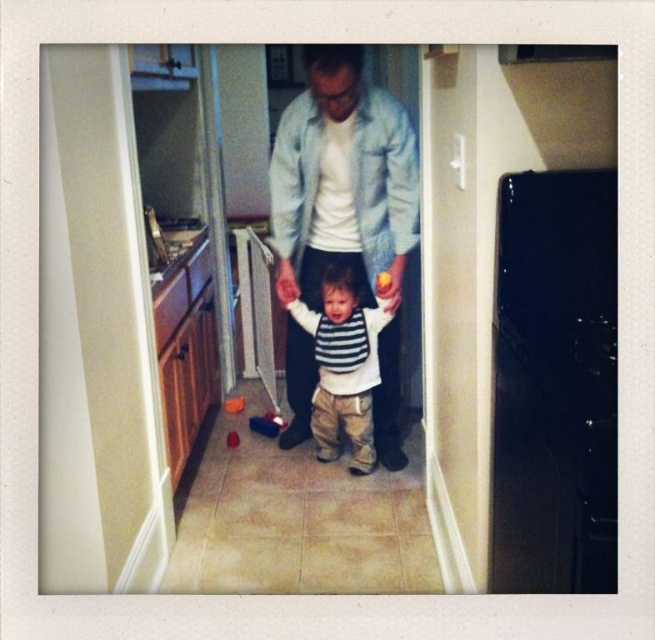
You are helping organize the laundry. You have two items to place in a drawer. The denim jacket at center and the striped cotton shirt at center. Which item should you place on the left side of the drawer to match their current positions?

The striped cotton shirt at center should be placed on the left side of the drawer because the denim jacket at center is currently positioned to its right.

You are helping organize a closet and need to place the denim jacket at center and the striped cotton shirt at center on a shelf. The shelf has limited space. Which item should you place first to ensure both fit?

The striped cotton shirt at center is smaller than the denim jacket at center, so place the denim jacket at center first to accommodate its larger size, then the striped cotton shirt at center will fit beside it.

Looking at this image, you are helping organize a closet and need to place the denim jacket at center and the striped cotton shirt at center on a shelf. Which item requires more horizontal space?

The denim jacket at center requires more horizontal space because its width is larger than the striped cotton shirt at center.